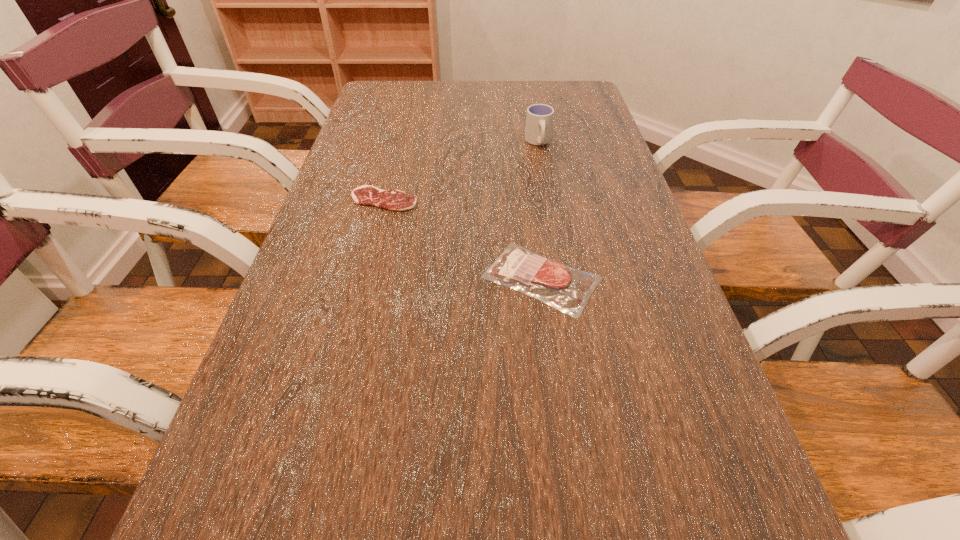
The width and height of the screenshot is (960, 540). I want to click on free space between the farther steak and the tallest object, so click(x=461, y=171).

Where is `free space between the farthest object and the shortest object`? The image size is (960, 540). free space between the farthest object and the shortest object is located at coordinates (461, 171).

Locate an element on the screen. unoccupied position between the right steak and the cup is located at coordinates (540, 211).

Locate an element on the screen. This screenshot has height=540, width=960. empty location between the second tallest object and the farthest object is located at coordinates (540, 211).

Identify the location of vacant space that's between the farther steak and the tallest object. (461, 171).

The height and width of the screenshot is (540, 960). What are the coordinates of `object that is the closest one to the leftmost object` in the screenshot? It's located at (567, 289).

Find the location of a particular element. The width and height of the screenshot is (960, 540). the second closest object to the right steak is located at coordinates (539, 120).

This screenshot has height=540, width=960. I want to click on free space that satisfies the following two spatial constraints: 1. on the front side of the right steak; 2. on the right side of the shorter steak, so (x=364, y=279).

The image size is (960, 540). Find the location of `vacant space that satisfies the following two spatial constraints: 1. on the front side of the nearer steak; 2. on the right side of the left steak`. vacant space that satisfies the following two spatial constraints: 1. on the front side of the nearer steak; 2. on the right side of the left steak is located at coordinates (364, 279).